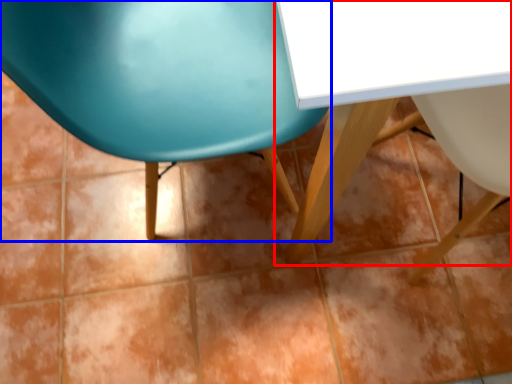
Question: Which of the following is the farthest to the observer, table (highlighted by a red box) or chair (highlighted by a blue box)?

Choices:
 (A) table
 (B) chair

Answer: (B)